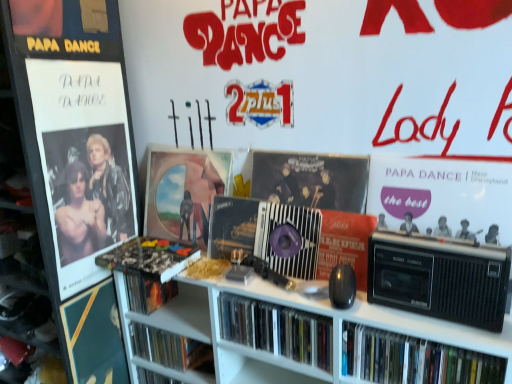
Question: Would you say matte black book at center, placed as the fourth book when sorted from right to left, is outside metallic glossy poster at left?

Choices:
 (A) no
 (B) yes

Answer: (B)

Question: Is matte black book at center, placed as the fourth book when sorted from right to left, positioned with its back to metallic glossy poster at left?

Choices:
 (A) no
 (B) yes

Answer: (A)

Question: From the image's perspective, is matte black book at center, placed as the fourth book when sorted from right to left, below metallic glossy poster at left?

Choices:
 (A) no
 (B) yes

Answer: (B)

Question: From a real-world perspective, is matte black book at center, acting as the first book starting from the left, on metallic glossy poster at left?

Choices:
 (A) yes
 (B) no

Answer: (B)

Question: Can you confirm if matte black book at center, acting as the first book starting from the left, is bigger than metallic glossy poster at left?

Choices:
 (A) yes
 (B) no

Answer: (B)

Question: From the image's perspective, is black plastic cassette at right, the second cassette when ordered from back to front, located above or below black plastic radio at right, the 4th book from the left?

Choices:
 (A) below
 (B) above

Answer: (B)

Question: Considering the positions of black plastic cassette at right, which is the second cassette in left-to-right order, and black plastic radio at right, the 4th book from the left, in the image, is black plastic cassette at right, which is the second cassette in left-to-right order, wider or thinner than black plastic radio at right, the 4th book from the left,?

Choices:
 (A) thin
 (B) wide

Answer: (B)

Question: Is black plastic cassette at right, which is the second cassette in left-to-right order, taller or shorter than black plastic radio at right, the 4th book from the left?

Choices:
 (A) short
 (B) tall

Answer: (B)

Question: Visually, is black plastic cassette at right, which is the second cassette in left-to-right order, positioned to the left or to the right of black plastic radio at right, which is the 1th book from right to left?

Choices:
 (A) right
 (B) left

Answer: (B)

Question: Considering their positions, is black plastic radio at right, the 4th book from the left, located in front of or behind black plastic cassette at right, which appears as the 1th cassette when viewed from the right?

Choices:
 (A) front
 (B) behind

Answer: (B)

Question: Looking at the image, does black plastic radio at right, the 4th book from the left, seem bigger or smaller compared to black plastic cassette at right, the 1th cassette positioned from the front?

Choices:
 (A) big
 (B) small

Answer: (B)

Question: Which is correct: black plastic radio at right, which is the 1th book from right to left, is inside black plastic cassette at right, the second cassette when ordered from back to front, or outside of it?

Choices:
 (A) inside
 (B) outside

Answer: (B)

Question: From a real-world perspective, is black plastic radio at right, the 4th book from the left, physically located above or below black plastic cassette at right, which appears as the 1th cassette when viewed from the right?

Choices:
 (A) below
 (B) above

Answer: (A)

Question: Considering the positions of metallic silver cassette at center, the 1th cassette positioned from the back, and matte black book at center, placed as the fourth book when sorted from right to left, in the image, is metallic silver cassette at center, the 1th cassette positioned from the back, wider or thinner than matte black book at center, placed as the fourth book when sorted from right to left,?

Choices:
 (A) thin
 (B) wide

Answer: (A)

Question: From the image's perspective, is metallic silver cassette at center, which is the 2th cassette in right-to-left order, above or below matte black book at center, placed as the fourth book when sorted from right to left?

Choices:
 (A) below
 (B) above

Answer: (B)